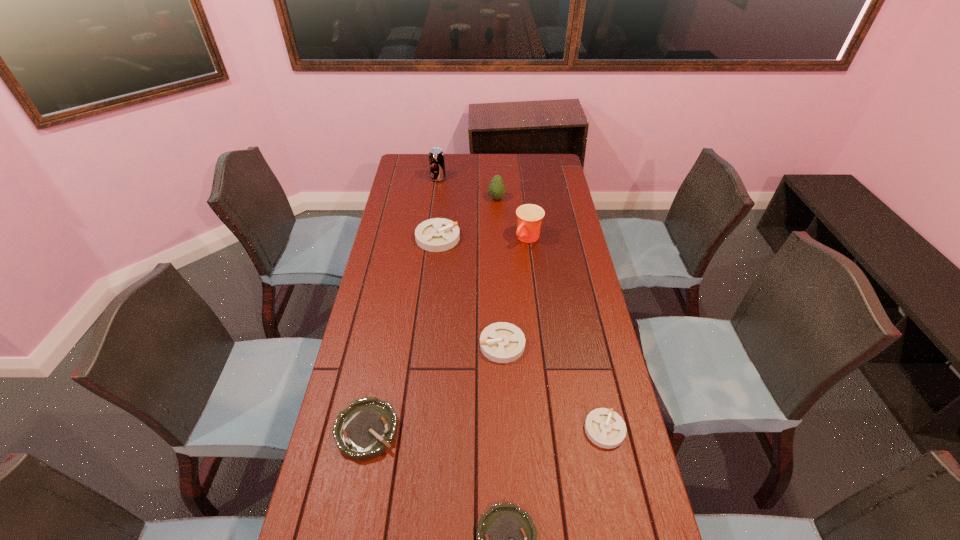
What are the coordinates of `the tallest object` in the screenshot? It's located at (436, 156).

Locate an element on the screen. Image resolution: width=960 pixels, height=540 pixels. the farthest object is located at coordinates (436, 156).

Image resolution: width=960 pixels, height=540 pixels. Find the location of `cup`. cup is located at coordinates (529, 216).

The height and width of the screenshot is (540, 960). In order to click on the seventh nearest object in this screenshot , I will do `click(496, 189)`.

The image size is (960, 540). Find the location of `avocado`. avocado is located at coordinates (496, 189).

Identify the location of the farthest gray ashtray. The image size is (960, 540). (438, 234).

The width and height of the screenshot is (960, 540). Identify the location of the farthest ashtray. tap(438, 234).

Where is `the second gray ashtray from right to left`? the second gray ashtray from right to left is located at coordinates (501, 342).

This screenshot has width=960, height=540. What are the coordinates of `the fifth tallest object` in the screenshot? It's located at tap(501, 342).

Where is `the left green ashtray`? The height and width of the screenshot is (540, 960). the left green ashtray is located at coordinates (368, 427).